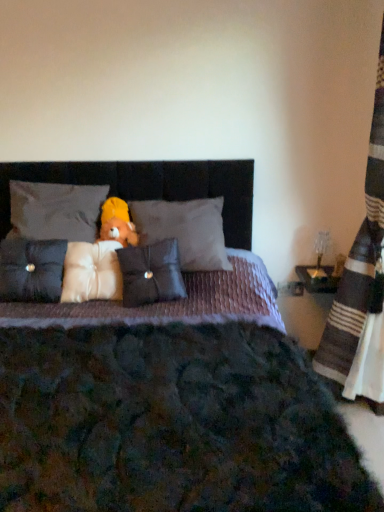
I want to click on velvet purple bed at center, so pos(211,423).

Where is `white satin pillow at upper center, arranged as the fourth pillow when viewed from the right`? white satin pillow at upper center, arranged as the fourth pillow when viewed from the right is located at coordinates (55, 210).

The height and width of the screenshot is (512, 384). Find the location of `striped fabric curtain at right`. striped fabric curtain at right is located at coordinates (361, 286).

The image size is (384, 512). What do you see at coordinates (91, 272) in the screenshot?
I see `white soft pillow at center, the third pillow in the left-to-right sequence` at bounding box center [91, 272].

You are a GUI agent. You are given a task and a screenshot of the screen. Output one action in this format:
    pyautogui.click(x=<x>, y=<y>)
    Task: Click on the velvet gray pillow at center, which is the 5th pillow from left to right
    The image size is (384, 512).
    Given the screenshot: What is the action you would take?
    pyautogui.click(x=185, y=230)

Is velvet purple bed at center at the back of white satin pillow at upper center, positioned as the second pillow in left-to-right order?

Correct, white satin pillow at upper center, positioned as the second pillow in left-to-right order, is looking away from velvet purple bed at center.

From the image's perspective, is white satin pillow at upper center, arranged as the fourth pillow when viewed from the right, below velvet purple bed at center?

No, from the image's perspective, white satin pillow at upper center, arranged as the fourth pillow when viewed from the right, is not beneath velvet purple bed at center.

Is white satin pillow at upper center, arranged as the fourth pillow when viewed from the right, with velvet purple bed at center?

white satin pillow at upper center, arranged as the fourth pillow when viewed from the right, and velvet purple bed at center are clearly separated.

Does point (89, 185) lie in front of point (229, 415)?

No, (89, 185) is behind (229, 415).

Between striped fabric curtain at right and velvet purple bed at center, which one appears on the right side from the viewer's perspective?

From the viewer's perspective, striped fabric curtain at right appears more on the right side.

From a real-world perspective, is striped fabric curtain at right physically above velvet purple bed at center?

Yes, from a real-world perspective, striped fabric curtain at right is above velvet purple bed at center.

Is striped fabric curtain at right oriented towards velvet purple bed at center?

Yes, striped fabric curtain at right is turned towards velvet purple bed at center.

Does striped fabric curtain at right have a greater width compared to velvet purple bed at center?

No, striped fabric curtain at right is not wider than velvet purple bed at center.

From a real-world perspective, does translucent glass table lamp at right sit lower than white soft pillow at center, marked as the third pillow in a right-to-left arrangement?

Yes.

Which object is more forward, translucent glass table lamp at right or white soft pillow at center, marked as the third pillow in a right-to-left arrangement?

white soft pillow at center, marked as the third pillow in a right-to-left arrangement.

Is translucent glass table lamp at right not close to white soft pillow at center, the third pillow in the left-to-right sequence?

Yes.

Could you tell me if translucent glass table lamp at right is turned towards white soft pillow at center, marked as the third pillow in a right-to-left arrangement?

No, translucent glass table lamp at right is not facing towards white soft pillow at center, marked as the third pillow in a right-to-left arrangement.

Is point (312, 383) positioned behind point (72, 227)?

That is False.

Is velvet purple bed at center in front of or behind white satin pillow at upper center, positioned as the second pillow in left-to-right order, in the image?

velvet purple bed at center is positioned closer to the viewer than white satin pillow at upper center, positioned as the second pillow in left-to-right order.

Is velvet purple bed at center oriented towards white satin pillow at upper center, positioned as the second pillow in left-to-right order?

No.

There is a striped fabric curtain at right. Where is `the 4th pillow below it (from a real-world perspective)`? This screenshot has height=512, width=384. the 4th pillow below it (from a real-world perspective) is located at coordinates (91, 272).

What's the angular difference between striped fabric curtain at right and white soft pillow at center, the third pillow in the left-to-right sequence,'s facing directions?

97.5 degrees separate the facing orientations of striped fabric curtain at right and white soft pillow at center, the third pillow in the left-to-right sequence.

Looking at this image, which object is wider, striped fabric curtain at right or white soft pillow at center, marked as the third pillow in a right-to-left arrangement?

Wider between the two is striped fabric curtain at right.

In the scene shown: From a real-world perspective, does striped fabric curtain at right stand above white soft pillow at center, the third pillow in the left-to-right sequence?

Correct, in the physical world, striped fabric curtain at right is higher than white soft pillow at center, the third pillow in the left-to-right sequence.

Does point (371, 350) lie in front of point (37, 289)?

No, (371, 350) is behind (37, 289).

Identify the location of curtain on the right of suede-like gray pillow at left, which is counted as the first pillow, starting from the left. This screenshot has width=384, height=512. (361, 286).

From a real-world perspective, is striped fabric curtain at right positioned above or below suede-like gray pillow at left, arranged as the 5th pillow when viewed from the right?

striped fabric curtain at right is above suede-like gray pillow at left, arranged as the 5th pillow when viewed from the right.

From the image's perspective, would you say striped fabric curtain at right is shown under suede-like gray pillow at left, which is counted as the first pillow, starting from the left?

No, from the image's perspective, striped fabric curtain at right is not below suede-like gray pillow at left, which is counted as the first pillow, starting from the left.

Consider the image. From the image's perspective, which one is positioned lower, suede-like gray pillow at left, which is counted as the first pillow, starting from the left, or velvet purple bed at center?

velvet purple bed at center, from the image's perspective.

Is suede-like gray pillow at left, arranged as the 5th pillow when viewed from the right, completely or partially outside of velvet purple bed at center?

No, suede-like gray pillow at left, arranged as the 5th pillow when viewed from the right, is not outside of velvet purple bed at center.

Measure the distance from suede-like gray pillow at left, arranged as the 5th pillow when viewed from the right, to velvet purple bed at center.

suede-like gray pillow at left, arranged as the 5th pillow when viewed from the right, and velvet purple bed at center are 20.24 inches apart.

Consider the image. Can you tell me how much suede-like gray pillow at left, arranged as the 5th pillow when viewed from the right, and velvet purple bed at center differ in facing direction?

0.867 degrees separate the facing orientations of suede-like gray pillow at left, arranged as the 5th pillow when viewed from the right, and velvet purple bed at center.

I want to click on bed in front of the white satin pillow at upper center, positioned as the second pillow in left-to-right order, so click(x=211, y=423).

Find the location of `bed to the left of striped fabric curtain at right`. bed to the left of striped fabric curtain at right is located at coordinates (211, 423).

When comparing their distances from white satin pillow at upper center, positioned as the second pillow in left-to-right order, does yellow plush bear at center or striped fabric curtain at right seem further?

Among the two, striped fabric curtain at right is located further to white satin pillow at upper center, positioned as the second pillow in left-to-right order.

From the image, which object appears to be farther from white soft pillow at center, marked as the third pillow in a right-to-left arrangement, velvet gray pillow at center, which is the 5th pillow from left to right, or white satin pillow at upper center, arranged as the fourth pillow when viewed from the right?

velvet gray pillow at center, which is the 5th pillow from left to right, is further to white soft pillow at center, marked as the third pillow in a right-to-left arrangement.

From the image, which object appears to be nearer to white soft pillow at center, marked as the third pillow in a right-to-left arrangement, velvet gray pillow at center, arranged as the 1th pillow when viewed from the right, or velvet purple bed at center?

The object closer to white soft pillow at center, marked as the third pillow in a right-to-left arrangement, is velvet gray pillow at center, arranged as the 1th pillow when viewed from the right.

Which object lies further to the anchor point velvet gray pillow at center, arranged as the 1th pillow when viewed from the right, translucent glass table lamp at right or white satin pillow at upper center, positioned as the second pillow in left-to-right order?

translucent glass table lamp at right.

When comparing their distances from striped fabric curtain at right, does velvet gray pillow at center, which is the 5th pillow from left to right, or velvet purple bed at center seem closer?

Among the two, velvet gray pillow at center, which is the 5th pillow from left to right, is located nearer to striped fabric curtain at right.

When comparing their distances from satin gray pillow at center, placed as the 4th pillow when sorted from left to right, does yellow plush bear at center or velvet purple bed at center seem further?

Among the two, velvet purple bed at center is located further to satin gray pillow at center, placed as the 4th pillow when sorted from left to right.

Considering their positions, is satin gray pillow at center, placed as the 4th pillow when sorted from left to right, positioned further to suede-like gray pillow at left, arranged as the 5th pillow when viewed from the right, than white soft pillow at center, the third pillow in the left-to-right sequence?

satin gray pillow at center, placed as the 4th pillow when sorted from left to right, is further to suede-like gray pillow at left, arranged as the 5th pillow when viewed from the right.

Based on their spatial positions, is striped fabric curtain at right or white satin pillow at upper center, positioned as the second pillow in left-to-right order, closer to velvet gray pillow at center, arranged as the 1th pillow when viewed from the right?

Based on the image, white satin pillow at upper center, positioned as the second pillow in left-to-right order, appears to be nearer to velvet gray pillow at center, arranged as the 1th pillow when viewed from the right.

At what (x,y) coordinates should I click in order to perform the action: click on table lamp situated between velvet gray pillow at center, arranged as the 1th pillow when viewed from the right, and striped fabric curtain at right from left to right. Please return your answer as a coordinate pair (x, y). Looking at the image, I should click on (320, 258).

Find the location of a particular element. The width and height of the screenshot is (384, 512). bed located between suede-like gray pillow at left, arranged as the 5th pillow when viewed from the right, and striped fabric curtain at right in the left-right direction is located at coordinates (211, 423).

In order to click on curtain between velvet purple bed at center and translucent glass table lamp at right in the front-back direction in this screenshot , I will do `click(361, 286)`.

I want to click on toy situated between suede-like gray pillow at left, arranged as the 5th pillow when viewed from the right, and satin gray pillow at center, placed as the 4th pillow when sorted from left to right, from left to right, so click(x=117, y=223).